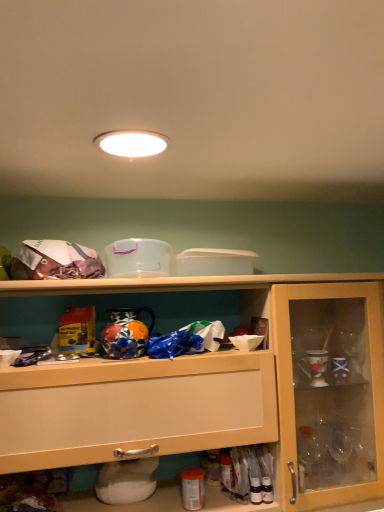
Question: Should I look upward or downward to see white glossy light fixture at upper center?

Choices:
 (A) up
 (B) down

Answer: (A)

Question: Is white glossy light fixture at upper center not within wooden cabinet at center?

Choices:
 (A) yes
 (B) no

Answer: (A)

Question: Can you confirm if white glossy light fixture at upper center is shorter than wooden cabinet at center?

Choices:
 (A) yes
 (B) no

Answer: (A)

Question: Is white glossy light fixture at upper center aimed at wooden cabinet at center?

Choices:
 (A) yes
 (B) no

Answer: (B)

Question: Considering the relative sizes of white glossy light fixture at upper center and wooden cabinet at center in the image provided, is white glossy light fixture at upper center smaller than wooden cabinet at center?

Choices:
 (A) no
 (B) yes

Answer: (B)

Question: Does white glossy light fixture at upper center lie in front of wooden cabinet at center?

Choices:
 (A) no
 (B) yes

Answer: (B)

Question: Is white glossy light fixture at upper center taller than wooden cabinet at center?

Choices:
 (A) no
 (B) yes

Answer: (A)

Question: Is wooden cabinet at center shorter than white glossy light fixture at upper center?

Choices:
 (A) yes
 (B) no

Answer: (B)

Question: From the image's perspective, would you say wooden cabinet at center is shown under white glossy light fixture at upper center?

Choices:
 (A) yes
 (B) no

Answer: (A)

Question: Would you say wooden cabinet at center contains white glossy light fixture at upper center?

Choices:
 (A) yes
 (B) no

Answer: (B)

Question: Can you see wooden cabinet at center touching white glossy light fixture at upper center?

Choices:
 (A) no
 (B) yes

Answer: (A)

Question: Is wooden cabinet at center to the right of white glossy light fixture at upper center from the viewer's perspective?

Choices:
 (A) no
 (B) yes

Answer: (B)

Question: Is wooden cabinet at center oriented towards white glossy light fixture at upper center?

Choices:
 (A) yes
 (B) no

Answer: (B)

Question: In terms of height, does wooden cabinet at center look taller or shorter compared to white glossy light fixture at upper center?

Choices:
 (A) tall
 (B) short

Answer: (A)